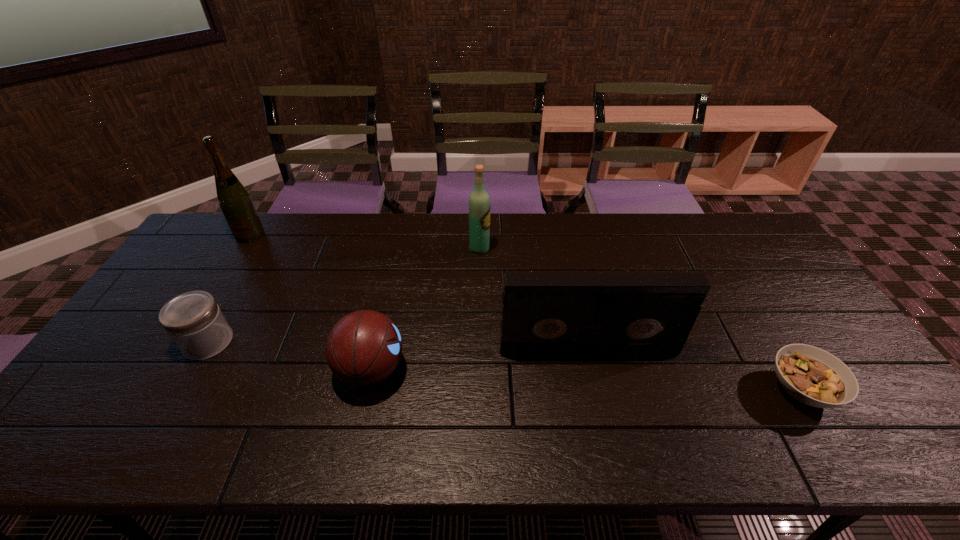
Image resolution: width=960 pixels, height=540 pixels. What are the coordinates of `vacant area between the shortest object and the jar` in the screenshot? It's located at (505, 366).

The image size is (960, 540). Find the location of `free space between the fifth tallest object and the left wine bottle`. free space between the fifth tallest object and the left wine bottle is located at coordinates (228, 288).

Identify the location of free space between the fifth tallest object and the left wine bottle. The width and height of the screenshot is (960, 540). (228, 288).

The image size is (960, 540). Identify the location of free spot between the left wine bottle and the shorter wine bottle. (365, 242).

Select which object is the third closest to the stew. Please provide its 2D coordinates. Your answer should be formatted as a tuple, i.e. [(x, y)], where the tuple contains the x and y coordinates of a point satisfying the conditions above.

[(363, 348)]

You are a GUI agent. You are given a task and a screenshot of the screen. Output one action in this format:
    pyautogui.click(x=<x>, y=<y>)
    Task: Click on the closest object relative to the fifth shortest object
    The image size is (960, 540).
    Given the screenshot: What is the action you would take?
    pyautogui.click(x=542, y=314)

What are the coordinates of `free space in the image that satisfies the following two spatial constraints: 1. on the front side of the shortest object; 2. on the right side of the fourth shortest object` in the screenshot? It's located at (597, 390).

Locate an element on the screen. blank area in the image that satisfies the following two spatial constraints: 1. on the front-facing side of the left wine bottle; 2. on the right side of the shortest object is located at coordinates (153, 390).

You are a GUI agent. You are given a task and a screenshot of the screen. Output one action in this format:
    pyautogui.click(x=<x>, y=<y>)
    Task: Click on the vacant area that satisfies the following two spatial constraints: 1. on the front side of the fifth object from left to right; 2. on the left side of the stew
    The height and width of the screenshot is (540, 960).
    Given the screenshot: What is the action you would take?
    pyautogui.click(x=597, y=390)